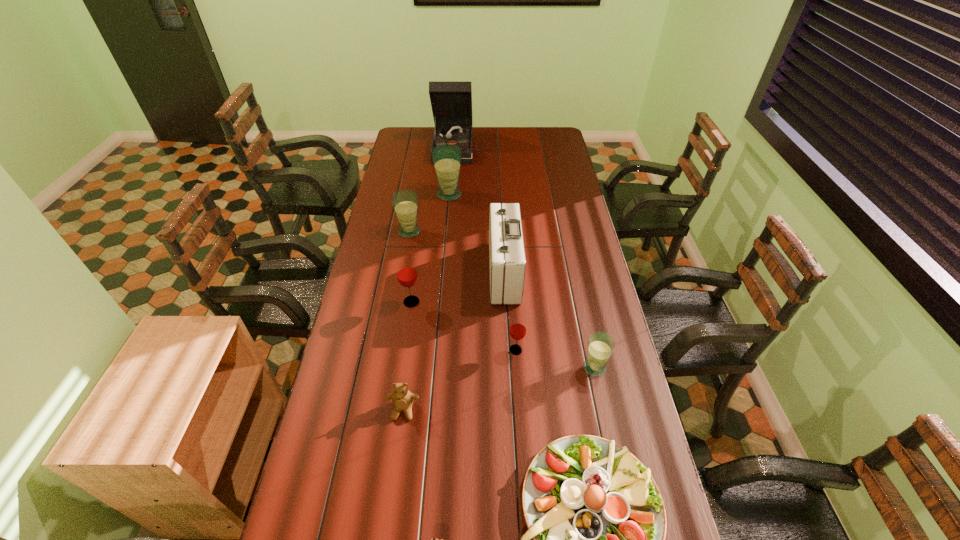
You are a GUI agent. You are given a task and a screenshot of the screen. Output one action in this format:
    pyautogui.click(x=<x>, y=<y>)
    Task: Click on the nearest glass
    
    Given the screenshot: What is the action you would take?
    (x=601, y=345)

Identify the location of the fourth farthest glass. This screenshot has width=960, height=540. (517, 331).

The height and width of the screenshot is (540, 960). Find the location of `the sixth farthest object`. the sixth farthest object is located at coordinates (517, 331).

Where is `teddy bear`? teddy bear is located at coordinates (402, 399).

I want to click on vacant space located 0.150m on the front-facing side of the phonograph_record, so click(x=456, y=181).

The image size is (960, 540). What are the coordinates of `blank space located on the right of the ninth nearest object` in the screenshot? It's located at (530, 195).

Find the location of a particular element. The image size is (960, 540). vacant area situated on the front-facing side of the red first-aid kit is located at coordinates (394, 272).

Identify the location of vacant space located on the front-facing side of the red first-aid kit. Image resolution: width=960 pixels, height=540 pixels. (421, 272).

This screenshot has width=960, height=540. In order to click on blank space located on the front-facing side of the red first-aid kit in this screenshot , I will do `click(461, 272)`.

Where is `free location located on the right of the third farthest glass`? free location located on the right of the third farthest glass is located at coordinates (513, 302).